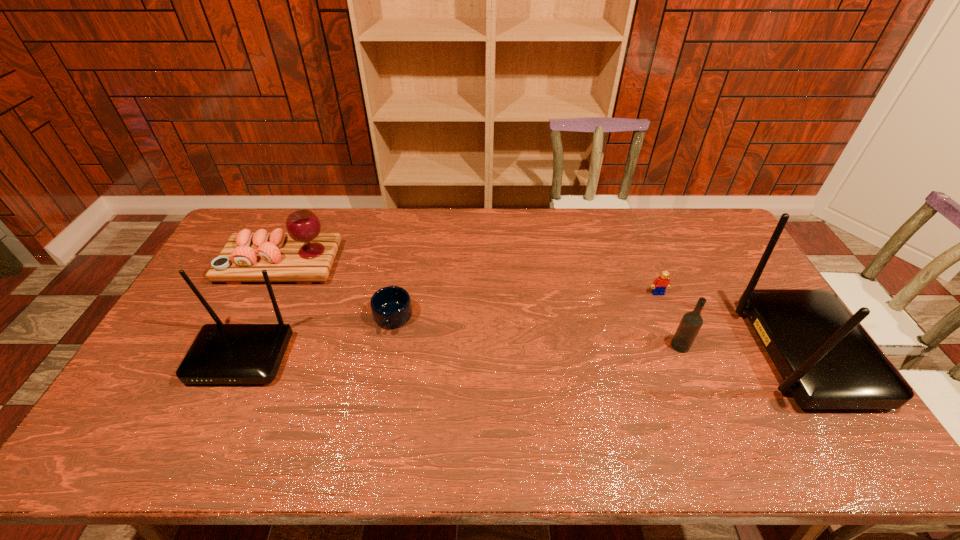
Locate an element on the screen. This screenshot has width=960, height=540. free space that satisfies the following two spatial constraints: 1. on the front-facing side of the vodka; 2. on the right side of the second shortest object is located at coordinates (679, 346).

Identify the location of vacant region that satisfies the following two spatial constraints: 1. with the handle on the side of the vodka; 2. on the left side of the fourth object from right to left. (388, 346).